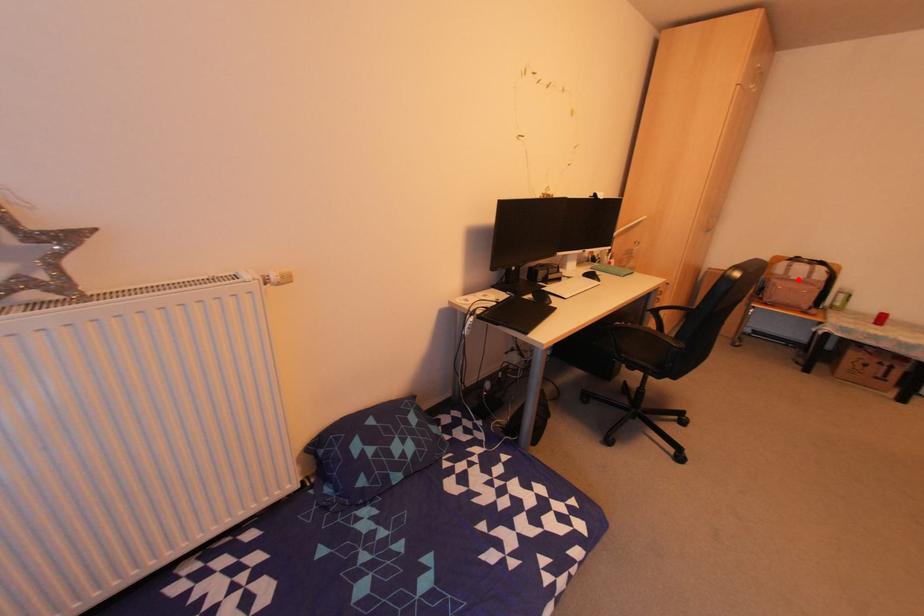
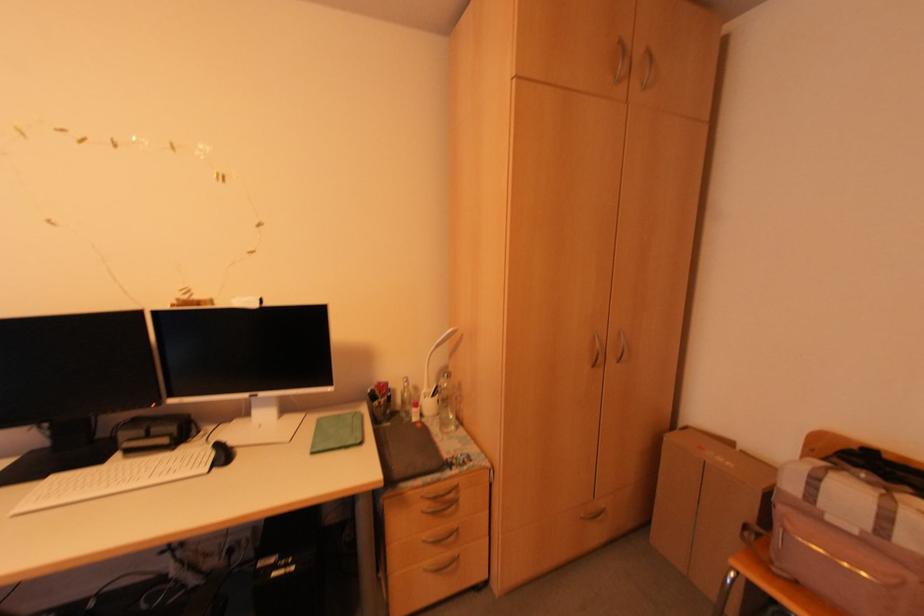
Locate, in the second image, the point that corresponds to the highlighted location in the first image.

(854, 532)